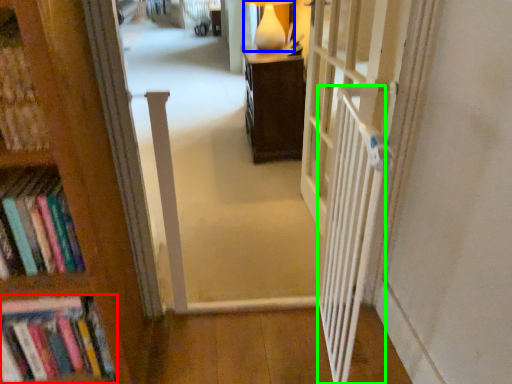
Question: Estimate the real-world distances between objects in this image. Which object is closer to book (highlighted by a red box), table lamp (highlighted by a blue box) or balustrade (highlighted by a green box)?

Choices:
 (A) table lamp
 (B) balustrade

Answer: (B)